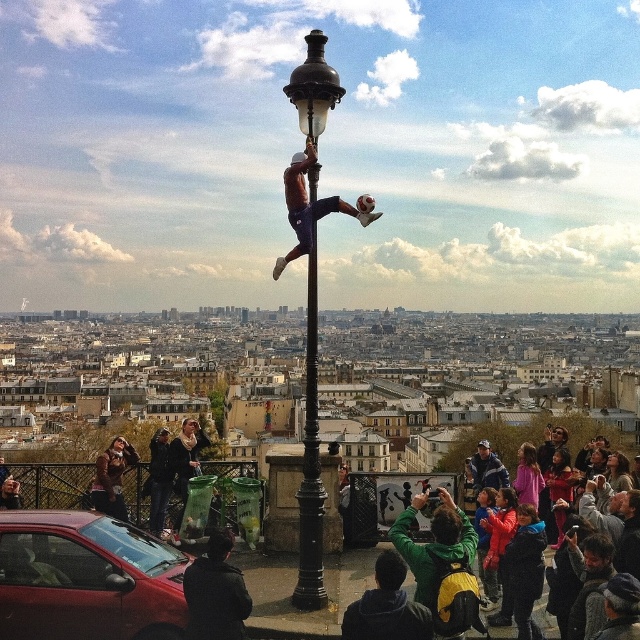
You are a drone operator trying to capture a photo of the black polished metal street light at center. The drone is currently at point A, which is at coordinates 0.5, 0.5. To get the best shot, you need to move the drone to the exact location of the street light. What direction should you move the drone from point A to reach the street light?

The black polished metal street light at center is located at point (310, 460). Since the drone is at (320, 320), you need to move it northeast to reach the street light.

You are a photographer analyzing the composition of this image. Which object, the black polished metal street light at center or the blue denim jacket at center, is positioned higher in the frame?

The black polished metal street light at center is located above the blue denim jacket at center in the frame.